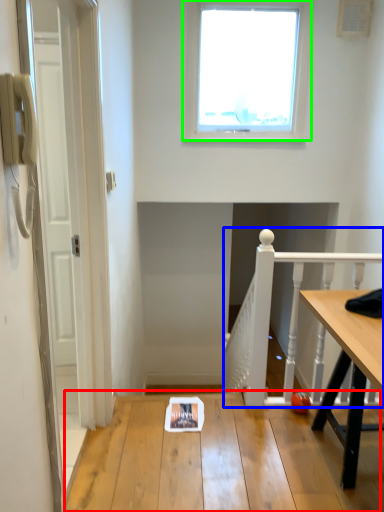
Question: Which object is positioned farthest from table (highlighted by a red box)? Select from rail (highlighted by a blue box) and window (highlighted by a green box).

Choices:
 (A) rail
 (B) window

Answer: (B)